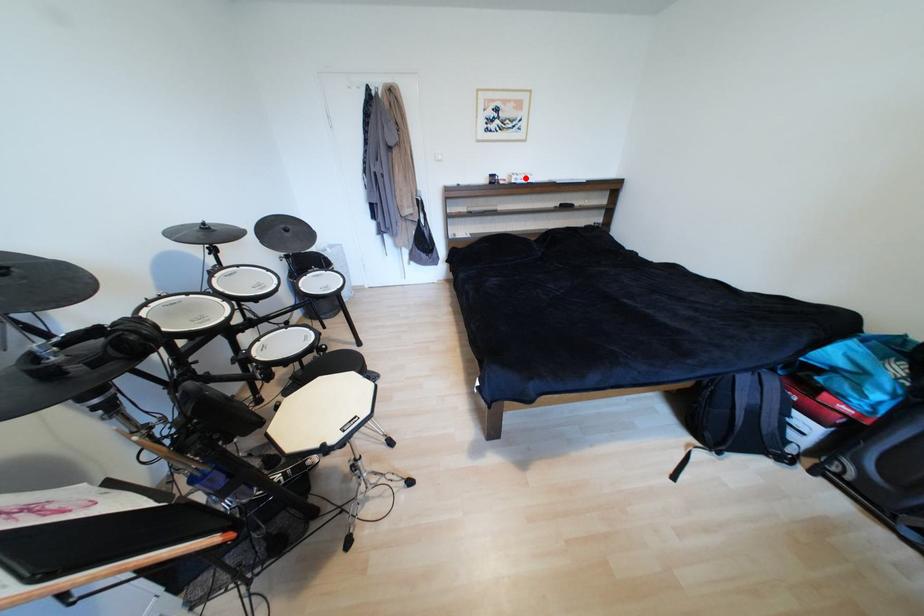
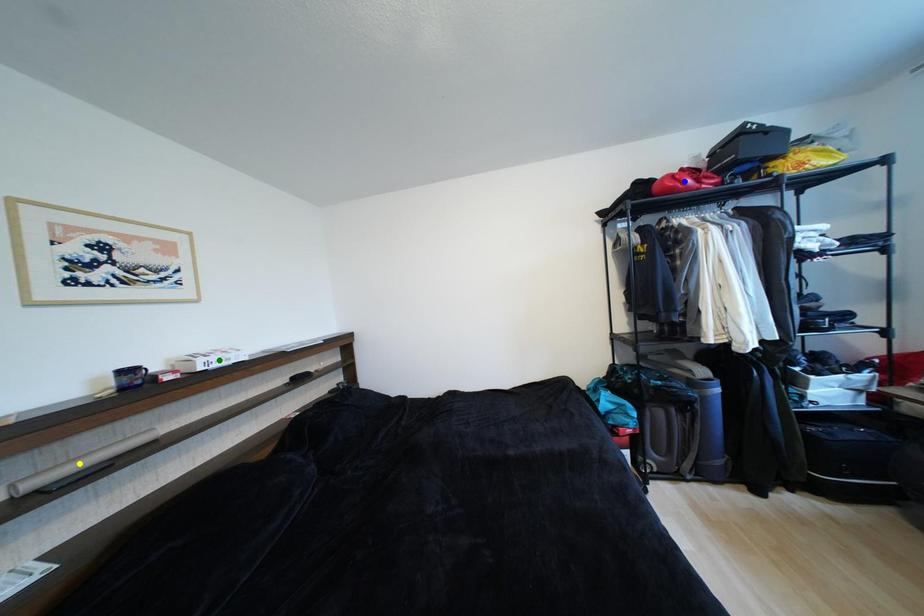
Question: I am providing you with two images of the same scene from different viewpoints. A red point is marked on the first image. You are given multiple points on the second image. Which point in image 2 represents the same 3d spot as the red point in image 1?

Choices:
 (A) yellow point
 (B) blue point
 (C) green point

Answer: (C)